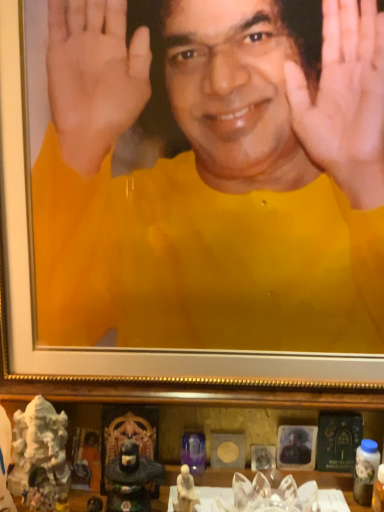
Question: From a real-world perspective, is matte black statue at lower center on matte black portrait at lower center, placed as the first man when sorted from right to left?

Choices:
 (A) yes
 (B) no

Answer: (B)

Question: Considering the relative sizes of matte black statue at lower center and matte black portrait at lower center, the 2th man positioned from the left, in the image provided, is matte black statue at lower center smaller than matte black portrait at lower center, the 2th man positioned from the left,?

Choices:
 (A) no
 (B) yes

Answer: (A)

Question: Is the position of matte black statue at lower center more distant than that of matte black portrait at lower center, the 2th man positioned from the left?

Choices:
 (A) no
 (B) yes

Answer: (A)

Question: Is matte black statue at lower center positioned in front of matte black portrait at lower center, the 2th man positioned from the left?

Choices:
 (A) yes
 (B) no

Answer: (A)

Question: Can you confirm if matte black statue at lower center is shorter than matte black portrait at lower center, placed as the first man when sorted from bottom to top?

Choices:
 (A) no
 (B) yes

Answer: (A)

Question: Would you say yellow matte shirt at center, which is the second man in right-to-left order, is inside or outside white marble statue at lower left, the first toy in the left-to-right sequence?

Choices:
 (A) inside
 (B) outside

Answer: (B)

Question: Is yellow matte shirt at center, the first man when ordered from left to right, in front of or behind white marble statue at lower left, which is the 2th toy in right-to-left order, in the image?

Choices:
 (A) behind
 (B) front

Answer: (B)

Question: From a real-world perspective, is yellow matte shirt at center, marked as the 2th man in a bottom-to-top arrangement, above or below white marble statue at lower left, the first toy in the left-to-right sequence?

Choices:
 (A) above
 (B) below

Answer: (A)

Question: Looking at the image, does yellow matte shirt at center, the first man when ordered from left to right, seem bigger or smaller compared to white marble statue at lower left, which is the 2th toy in right-to-left order?

Choices:
 (A) big
 (B) small

Answer: (A)

Question: In the image, is white marble statue at lower left, which is the 2th toy in right-to-left order, positioned in front of or behind white porcelain statue at lower center, placed as the second toy when sorted from left to right?

Choices:
 (A) front
 (B) behind

Answer: (B)

Question: From a real-world perspective, is white marble statue at lower left, which is the 2th toy in right-to-left order, physically located above or below white porcelain statue at lower center, placed as the second toy when sorted from left to right?

Choices:
 (A) above
 (B) below

Answer: (A)

Question: From the image's perspective, is white marble statue at lower left, which is the 2th toy in right-to-left order, above or below white porcelain statue at lower center, placed as the second toy when sorted from left to right?

Choices:
 (A) below
 (B) above

Answer: (B)

Question: Looking at their shapes, would you say white marble statue at lower left, which is the 2th toy in right-to-left order, is wider or thinner than white porcelain statue at lower center, placed as the second toy when sorted from left to right?

Choices:
 (A) wide
 (B) thin

Answer: (A)

Question: Do you think matte black portrait at lower center, placed as the first man when sorted from bottom to top, is within matte black statue at lower center, or outside of it?

Choices:
 (A) outside
 (B) inside

Answer: (A)

Question: Is matte black portrait at lower center, placed as the first man when sorted from right to left, wider or thinner than matte black statue at lower center?

Choices:
 (A) thin
 (B) wide

Answer: (A)